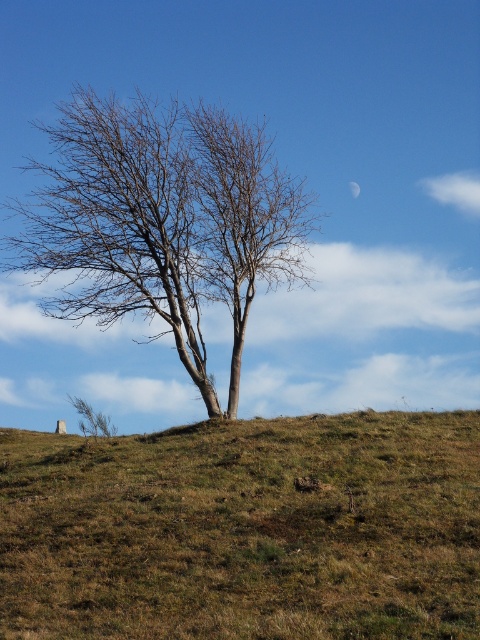
Is brown grassy hillside at center positioned behind bare wood tree at center?

No, it is in front of bare wood tree at center.

Who is positioned more to the left, brown grassy hillside at center or bare wood tree at center?

bare wood tree at center is more to the left.

At what (x,y) coordinates should I click in order to perform the action: click on brown grassy hillside at center. Please return your answer as a coordinate pair (x, y). This screenshot has height=640, width=480. Looking at the image, I should click on (244, 529).

Is point (144, 547) positioned after point (358, 193)?

No, it is in front of (358, 193).

Consider the image. Who is positioned more to the right, brown grassy hillside at center or silver metallic moon at upper center?

Positioned to the right is silver metallic moon at upper center.

Image resolution: width=480 pixels, height=640 pixels. Find the location of `brown grassy hillside at center`. brown grassy hillside at center is located at coordinates (244, 529).

Between bare wood tree at center and silver metallic moon at upper center, which one appears on the right side from the viewer's perspective?

From the viewer's perspective, silver metallic moon at upper center appears more on the right side.

Is point (92, 164) positioned after point (350, 195)?

That is False.

Describe the element at coordinates (163, 221) in the screenshot. I see `bare wood tree at center` at that location.

This screenshot has height=640, width=480. What are the coordinates of `bare wood tree at center` in the screenshot? It's located at (163, 221).